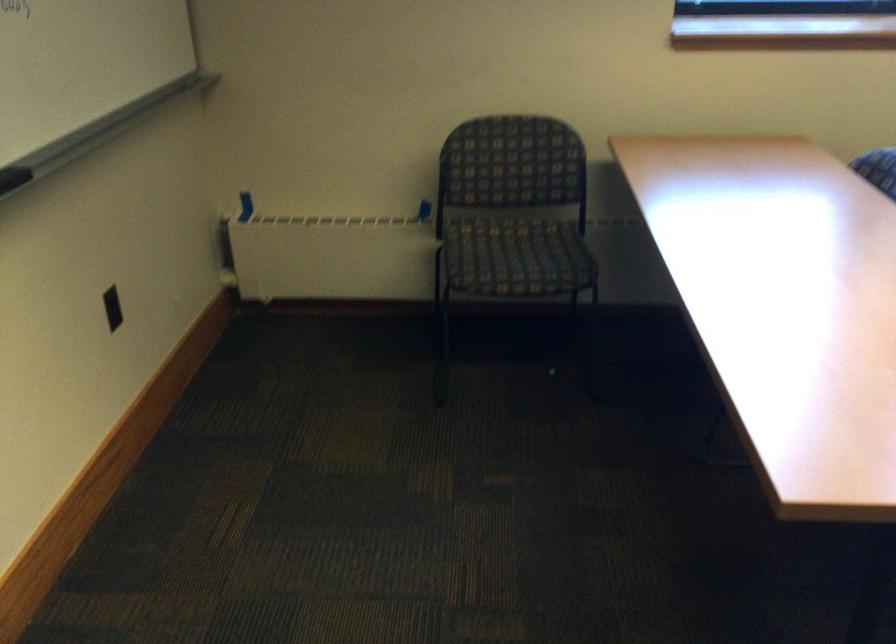
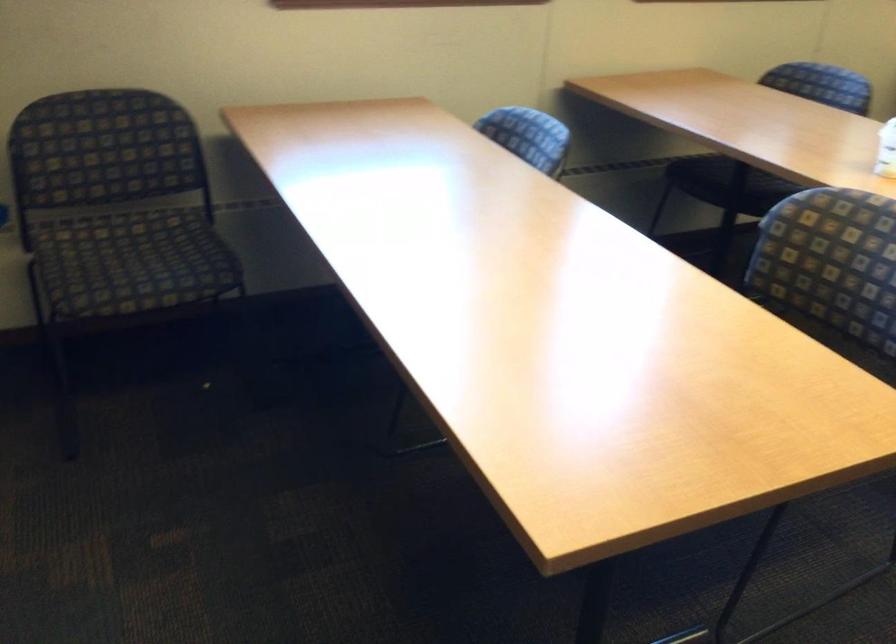
Question: Based on the continuous images, in which direction is the camera rotating? Reply with the corresponding letter.

Choices:
 (A) Left
 (B) Right
 (C) Up
 (D) Down

Answer: (B)